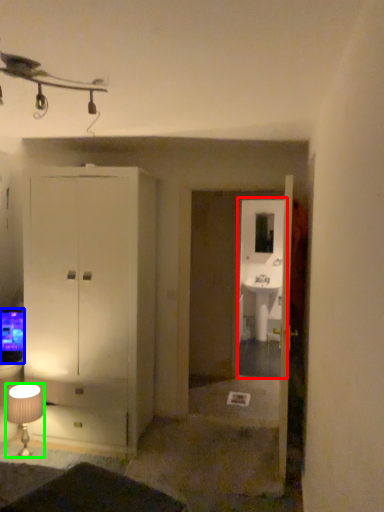
Question: Which is nearer to the glass door (highlighted by a red box)? television (highlighted by a blue box) or lamp (highlighted by a green box).

Choices:
 (A) television
 (B) lamp

Answer: (A)